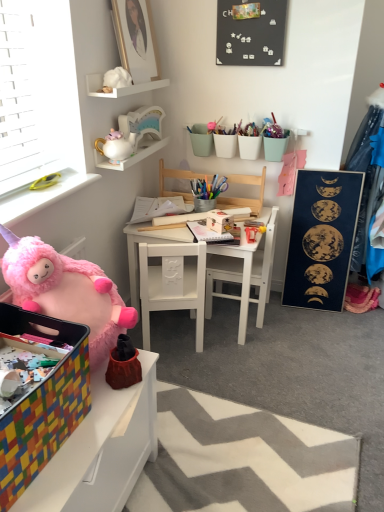
Question: Which direction should I rotate to look at white matte table at center, the 1th table from the back?

Choices:
 (A) left
 (B) right

Answer: (B)

Question: From the image's perspective, is multicolored plastic storage bin at lower left, marked as the first table in a bottom-to-top arrangement, under white glossy teapot at upper center, which ranks as the 3th toy in front-to-back order?

Choices:
 (A) yes
 (B) no

Answer: (A)

Question: From a real-world perspective, is multicolored plastic storage bin at lower left, which is counted as the first table, starting from the front, positioned under white glossy teapot at upper center, the 2th toy when ordered from top to bottom, based on gravity?

Choices:
 (A) yes
 (B) no

Answer: (A)

Question: Can you confirm if multicolored plastic storage bin at lower left, which is counted as the first table, starting from the front, is bigger than white glossy teapot at upper center, acting as the first toy starting from the back?

Choices:
 (A) no
 (B) yes

Answer: (B)

Question: Is multicolored plastic storage bin at lower left, positioned as the second table in top-to-bottom order, positioned beyond the bounds of white glossy teapot at upper center, acting as the first toy starting from the back?

Choices:
 (A) yes
 (B) no

Answer: (A)

Question: Can you confirm if multicolored plastic storage bin at lower left, positioned as the second table in top-to-bottom order, is shorter than white glossy teapot at upper center, the 2th toy when ordered from top to bottom?

Choices:
 (A) no
 (B) yes

Answer: (A)

Question: Is multicolored plastic storage bin at lower left, which is counted as the first table, starting from the front, behind white glossy teapot at upper center, the 2th toy when ordered from top to bottom?

Choices:
 (A) yes
 (B) no

Answer: (B)

Question: Does white ceramic teapot at upper left, the 2th shelf in the top-to-bottom sequence, have a smaller size compared to white matte table at center, the 2th table when ordered from bottom to top?

Choices:
 (A) no
 (B) yes

Answer: (B)

Question: From the image's perspective, is white ceramic teapot at upper left, the 2th shelf in the top-to-bottom sequence, below white matte table at center, the 1th table from the back?

Choices:
 (A) no
 (B) yes

Answer: (A)

Question: Is white ceramic teapot at upper left, acting as the 1th shelf starting from the bottom, bigger than white matte table at center, the 2th table when ordered from bottom to top?

Choices:
 (A) yes
 (B) no

Answer: (B)

Question: Can you confirm if white ceramic teapot at upper left, the 2th shelf in the top-to-bottom sequence, is positioned to the right of white matte table at center, which is counted as the second table, starting from the front?

Choices:
 (A) no
 (B) yes

Answer: (A)

Question: From the image's perspective, is white ceramic teapot at upper left, the 2th shelf in the top-to-bottom sequence, on white matte table at center, the 1th table from the back?

Choices:
 (A) yes
 (B) no

Answer: (A)

Question: Can you confirm if white ceramic teapot at upper left, acting as the 1th shelf starting from the bottom, is shorter than white matte table at center, which is counted as the second table, starting from the front?

Choices:
 (A) yes
 (B) no

Answer: (A)

Question: Does white glossy teapot at upper center, which ranks as the 3th toy in front-to-back order, have a lesser width compared to black matte board at upper center, the second bulletin board viewed from the right?

Choices:
 (A) yes
 (B) no

Answer: (B)